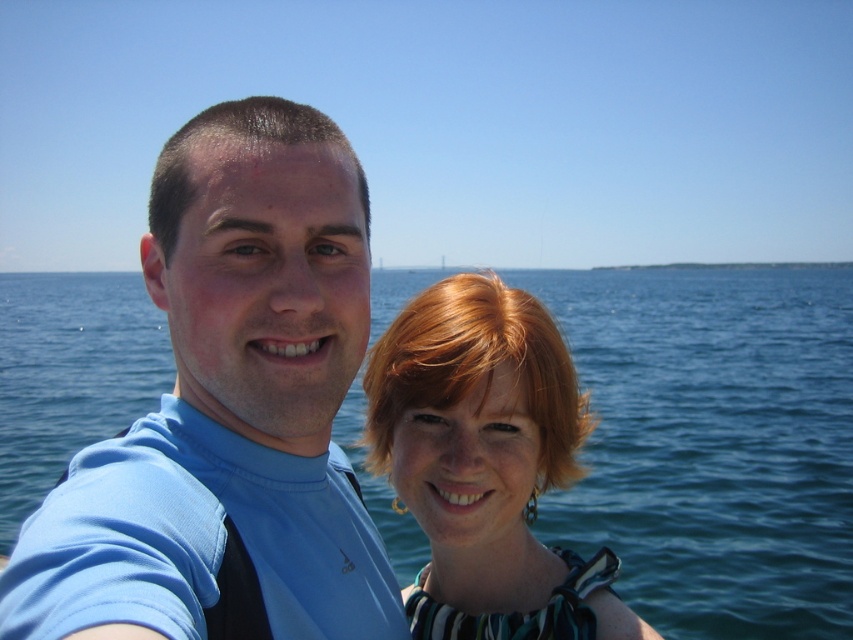
You are a photographer trying to capture a photo of the blue fabric shirt at center and the shiny green dress at center. Since both are at the center, how can you ensure both are in focus?

The blue fabric shirt at center is located above the shiny green dress at center, so you can adjust your camera to focus on the upper part of the frame where the blue fabric shirt at center is positioned, ensuring both are within the depth of field.

You are a photographer standing at a specific spot. You want to take a photo of the blue fabric shirt at center. What is the minimum distance you need to move forward or backward to ensure the shirt is in focus if your camera has a minimum focusing distance of 1.5 meters?

The blue fabric shirt at center is 1.79 meters away from the viewer. Since the camera requires a minimum focusing distance of 1.5 meters, you need to move forward by 0.29 meters to ensure the shirt is within the camera range.

You are a photographer trying to capture a photo of both individuals in the image. You notice two points marked on your camera screen at coordinates point [1,355] and point [221,145]. According to the scene description, which point is positioned further away from the camera?

Point [1,355] is behind point [221,145], so it is further away from the camera.